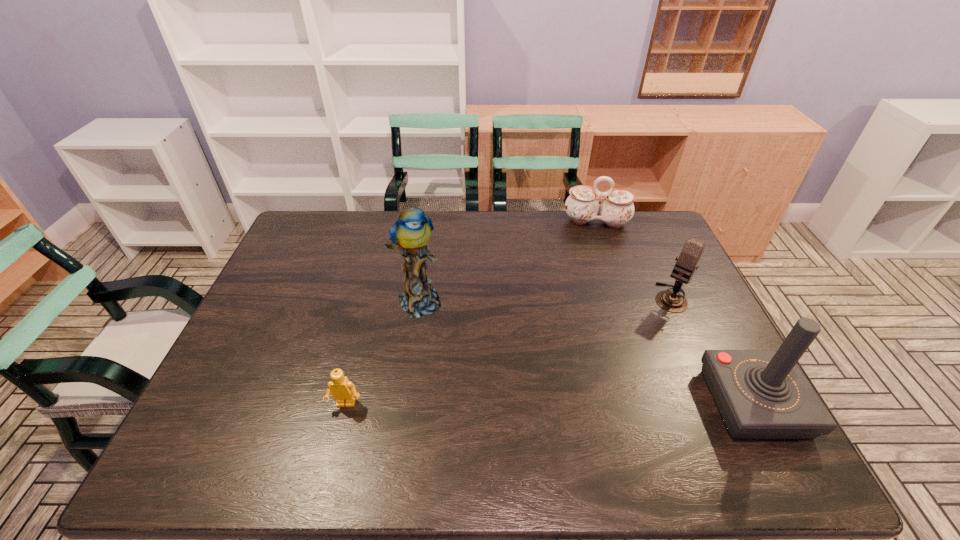
Where is `free spot on the desktop that is between the leftmost object and the fourth shortest object and is positioned on the front-facing side of the microphone`? This screenshot has width=960, height=540. free spot on the desktop that is between the leftmost object and the fourth shortest object and is positioned on the front-facing side of the microphone is located at coordinates (588, 403).

Find the location of `vacant spot on the desktop that is between the shortest object and the fourth shortest object and is positioned by the handle of the chinaware`. vacant spot on the desktop that is between the shortest object and the fourth shortest object and is positioned by the handle of the chinaware is located at coordinates (598, 403).

This screenshot has width=960, height=540. Identify the location of free spot on the desktop that is between the Lego and the second tallest object and is positioned on the face of the second object from left to right. (507, 404).